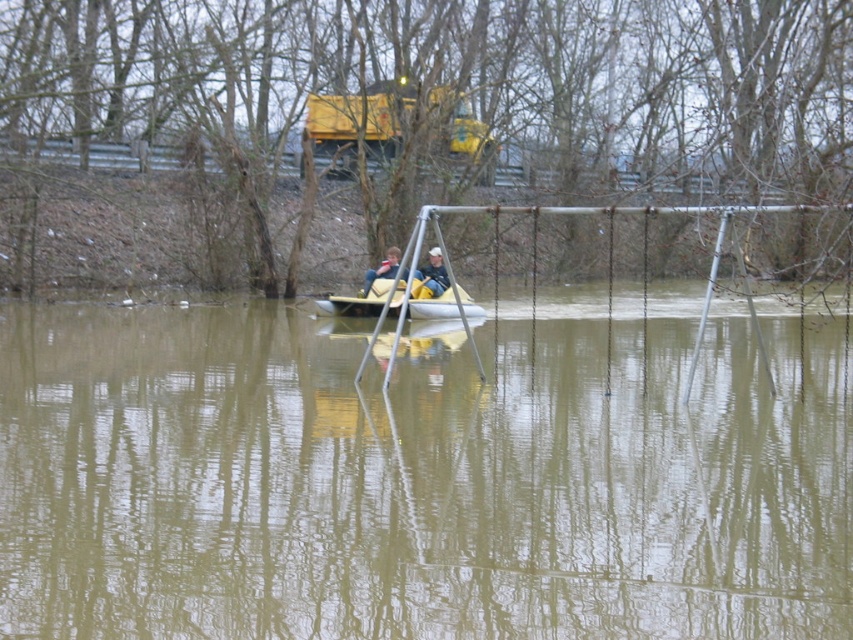
You are a lifeguard at the flooded playground and see the light blue denim jeans at center and the matte yellow life jacket at center. Which object is closer to you?

The light blue denim jeans at center is closer to you because the matte yellow life jacket at center is behind it.

You are standing at the edge of the flooded area and see the point marked as point (418, 480). What is located at that point?

The point (418, 480) marks brown murky water at center.

You are a hiker stranded in the flooded area and see the yellow rubber boat at center and the light blue denim jeans at center. Which object is positioned to the right when viewed from your perspective?

The yellow rubber boat at center is positioned to the right of the light blue denim jeans at center.